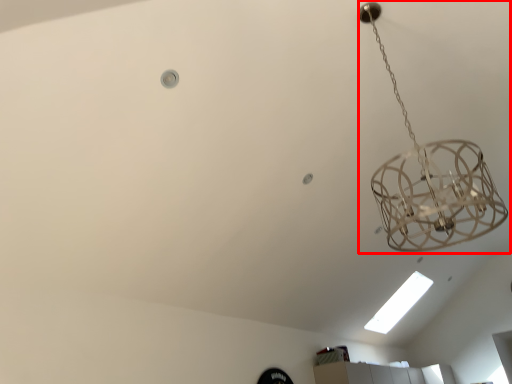
Question: From the image's perspective, where is lamp (annotated by the red box) located in relation to light bulb in the image?

Choices:
 (A) above
 (B) below

Answer: (A)